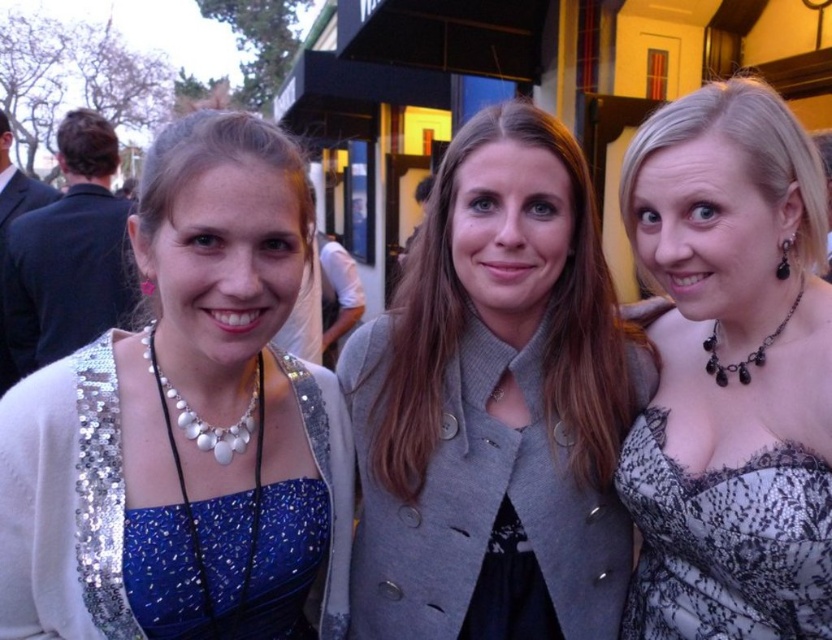
Can you confirm if blue sequined dress at left is positioned to the left of black beaded necklace at right?

Correct, you'll find blue sequined dress at left to the left of black beaded necklace at right.

Can you confirm if blue sequined dress at left is smaller than black beaded necklace at right?

No.

The width and height of the screenshot is (832, 640). I want to click on blue sequined dress at left, so click(104, 493).

Identify the location of blue sequined dress at left. (104, 493).

At what (x,y) coordinates should I click in order to perform the action: click on black lace dress at center. Please return your answer as a coordinate pair (x, y). The image size is (832, 640). Looking at the image, I should click on (726, 541).

Can you confirm if black lace dress at center is shorter than black beaded necklace at right?

In fact, black lace dress at center may be taller than black beaded necklace at right.

The width and height of the screenshot is (832, 640). What do you see at coordinates (726, 541) in the screenshot?
I see `black lace dress at center` at bounding box center [726, 541].

Image resolution: width=832 pixels, height=640 pixels. In order to click on black lace dress at center in this screenshot , I will do `click(726, 541)`.

Is point (271, 388) closer to viewer compared to point (474, 472)?

Yes, point (271, 388) is closer to viewer.

Locate an element on the screen. The width and height of the screenshot is (832, 640). satin blue dress at center is located at coordinates (186, 422).

Which is in front, point (156, 161) or point (532, 460)?

Point (156, 161)

This screenshot has width=832, height=640. Identify the location of satin blue dress at center. (186, 422).